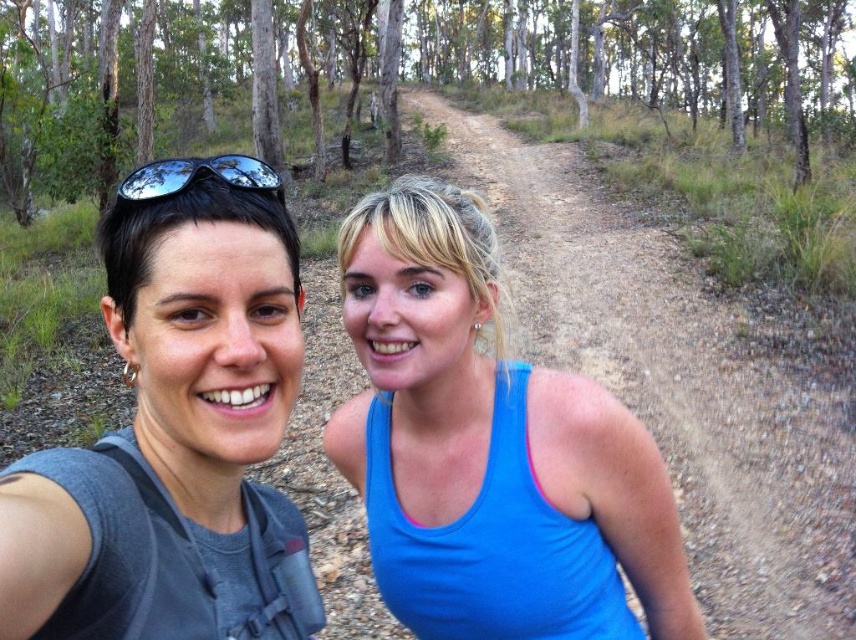
Question: Is dirt path at center thinner than sunglasses at upper left?

Choices:
 (A) yes
 (B) no

Answer: (B)

Question: Which of these objects is positioned farthest from the gray fabric tank top at left?

Choices:
 (A) dirt path at center
 (B) green matte forest at upper center
 (C) sunglasses at upper left
 (D) blue fabric tank top at center

Answer: (B)

Question: Which object appears farthest from the camera in this image?

Choices:
 (A) blue fabric tank top at center
 (B) green matte forest at upper center
 (C) sunglasses at upper left

Answer: (B)

Question: Does blue fabric tank top at center have a smaller size compared to gray fabric tank top at left?

Choices:
 (A) no
 (B) yes

Answer: (A)

Question: Considering the relative positions of green matte forest at upper center and dirt path at center in the image provided, where is green matte forest at upper center located with respect to dirt path at center?

Choices:
 (A) right
 (B) left

Answer: (B)

Question: Which point is farther to the camera?

Choices:
 (A) (36, 97)
 (B) (40, 520)
 (C) (780, 515)

Answer: (A)